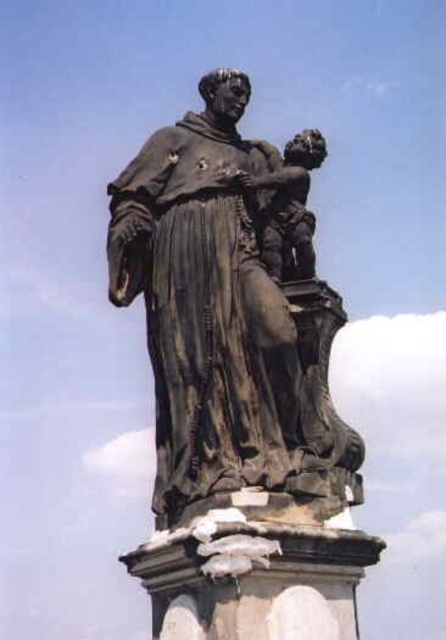
Question: Is bronze statue at center wider than bronze statue child at right?

Choices:
 (A) no
 (B) yes

Answer: (B)

Question: Which object is closer to the camera taking this photo?

Choices:
 (A) bronze statue at center
 (B) bronze statue child at right

Answer: (A)

Question: Does bronze statue at center appear under bronze statue child at right?

Choices:
 (A) yes
 (B) no

Answer: (A)

Question: Can you confirm if bronze statue at center is positioned below bronze statue child at right?

Choices:
 (A) yes
 (B) no

Answer: (A)